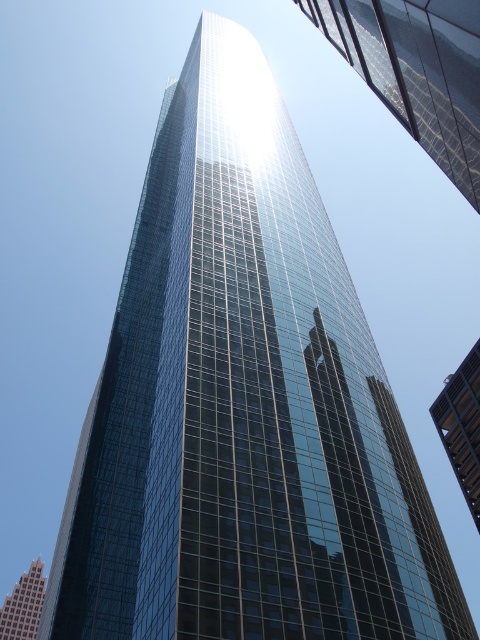
Question: Which is nearer to the shiny glass skyscraper at center?

Choices:
 (A) shiny glass skyscraper at upper right
 (B) glassy reflective skyscraper at center

Answer: (B)

Question: Does shiny glass skyscraper at upper right have a greater width compared to glassy reflective skyscraper at center?

Choices:
 (A) no
 (B) yes

Answer: (A)

Question: Can you confirm if shiny glass skyscraper at upper right is positioned to the right of glassy reflective skyscraper at center?

Choices:
 (A) no
 (B) yes

Answer: (A)

Question: Which of these objects is positioned farthest from the glassy reflective skyscraper at center?

Choices:
 (A) shiny glass skyscraper at center
 (B) shiny glass skyscraper at upper right

Answer: (A)

Question: Is shiny glass skyscraper at upper right to the right of glassy reflective skyscraper at center from the viewer's perspective?

Choices:
 (A) no
 (B) yes

Answer: (A)

Question: Among these points, which one is nearest to the camera?

Choices:
 (A) (458, 128)
 (B) (468, 406)

Answer: (A)